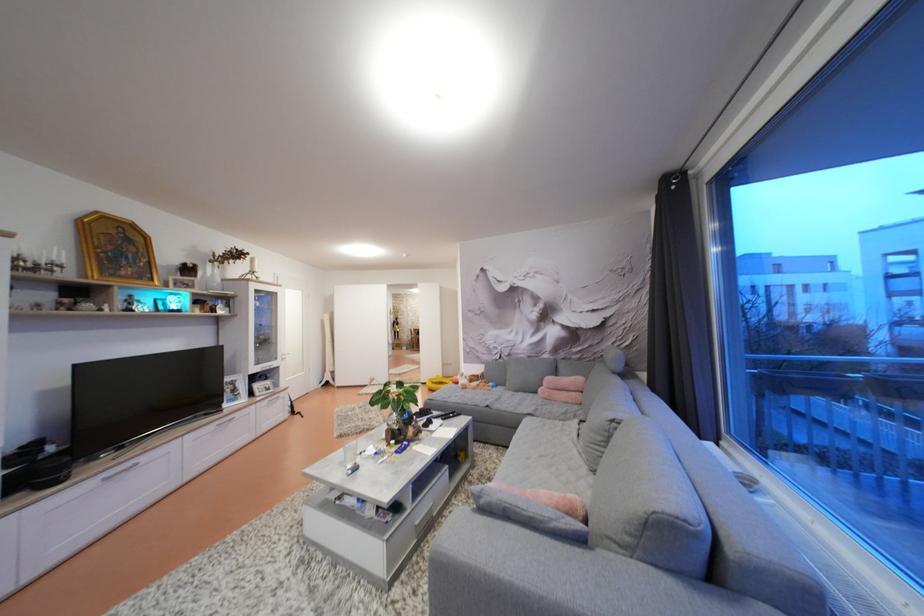
You are a GUI agent. You are given a task and a screenshot of the screen. Output one action in this format:
    pyautogui.click(x=<x>, y=<y>)
    Task: Click on the white sliding door handle
    This screenshot has height=616, width=924.
    Given the screenshot: What is the action you would take?
    pyautogui.click(x=265, y=365)